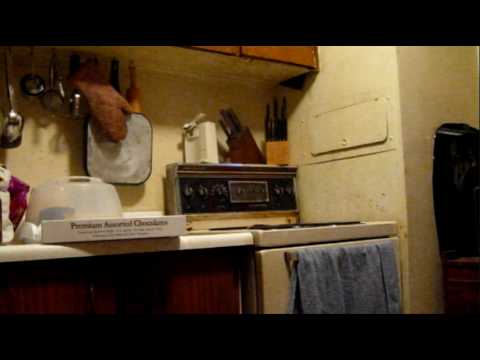
Identify the location of doors to counter. This screenshot has height=360, width=480. (65, 287), (175, 293).